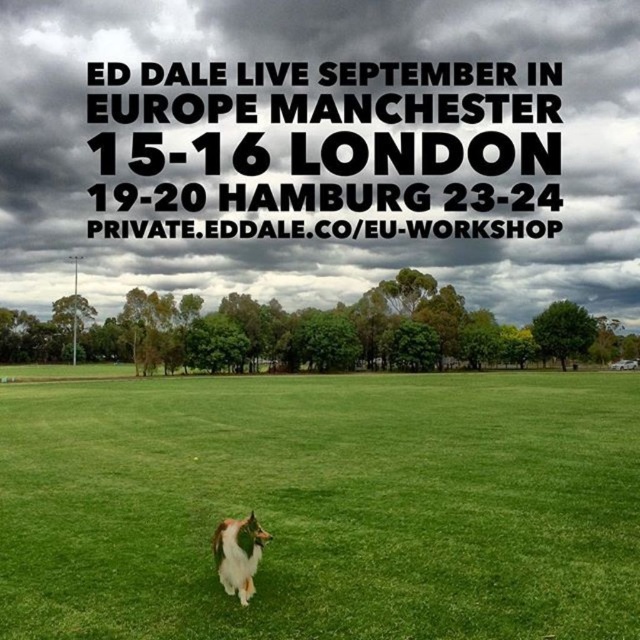
Looking at this image, you are standing in the grassy field and want to place a small garden ornament exactly where the green grass at center is. According to the coordinates provided, where should you place it?

The green grass at center should be placed at coordinates point [323,506] as specified in the description.

You are a photographer trying to capture the white fluffy dog at lower center in the frame. Since the green grass at center is wider than the dog, where should you position the camera to ensure the dog is centered and the grass fills the background?

Since the green grass at center is wider than the white fluffy dog at lower center, position the camera so the dog is centered horizontally. The grass will naturally fill the background due to its greater width, creating a balanced composition.

You are standing at the origin of the coordinate system in the image. There are two points marked in the scene. Which point is closer to you, point (161, 529) or point (228, 518)?

Point (228, 518) is closer to you because it is in front of point (161, 529).